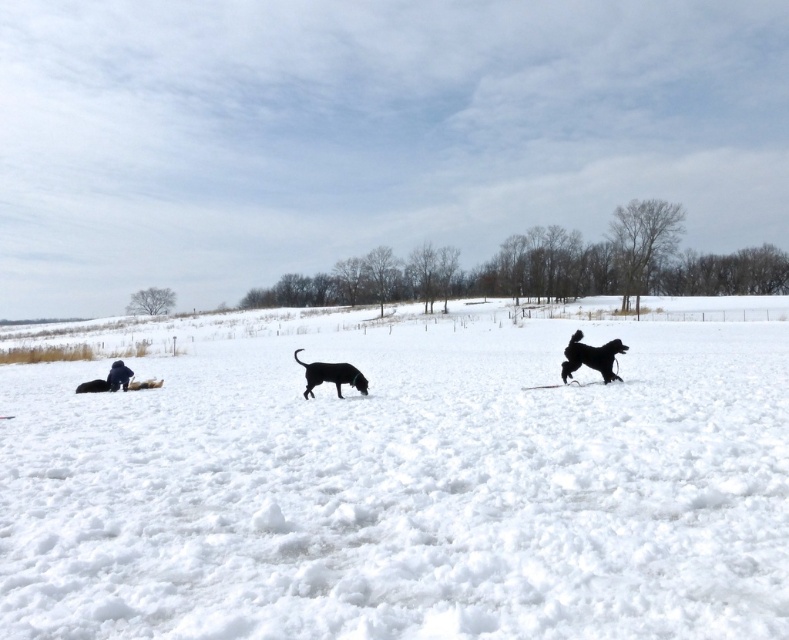
Question: Among these objects, which one is farthest from the camera?

Choices:
 (A) white fluffy snow at center
 (B) black matte dog at center

Answer: (B)

Question: Can you confirm if black fur dog at right is positioned below black matte dog at center?

Choices:
 (A) no
 (B) yes

Answer: (A)

Question: Among these objects, which one is nearest to the camera?

Choices:
 (A) white fluffy snow at center
 (B) black fur dog at right

Answer: (A)

Question: Which object is farther from the camera taking this photo?

Choices:
 (A) black matte dog at center
 (B) white fluffy snow at center
 (C) black fur dog at right

Answer: (C)

Question: Does white fluffy snow at center have a smaller size compared to black fur dog at right?

Choices:
 (A) yes
 (B) no

Answer: (B)

Question: Does white fluffy snow at center appear over black fur dog at right?

Choices:
 (A) yes
 (B) no

Answer: (B)